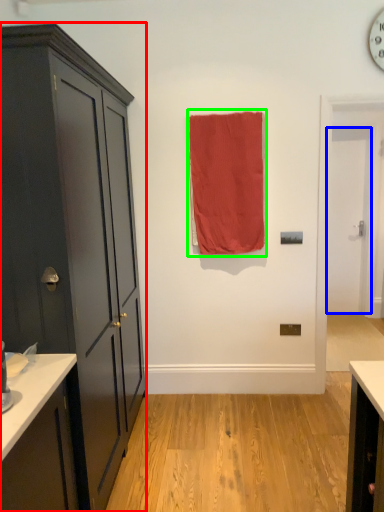
Question: Which object is the farthest from cabinetry (highlighted by a red box)? Choose among these: door (highlighted by a blue box) or curtain (highlighted by a green box).

Choices:
 (A) door
 (B) curtain

Answer: (A)